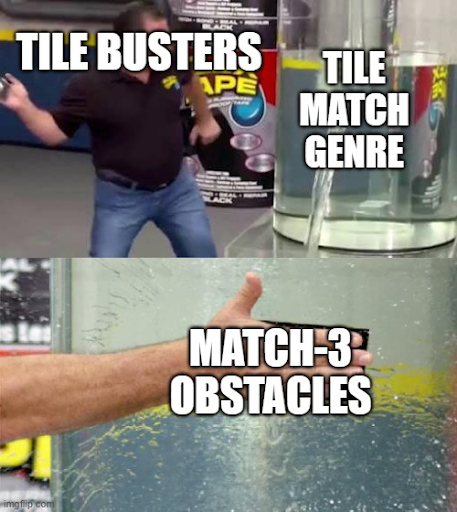
Image resolution: width=457 pixels, height=512 pixels. What are the coordinates of `tile` in the screenshot? It's located at (58, 46), (354, 64).